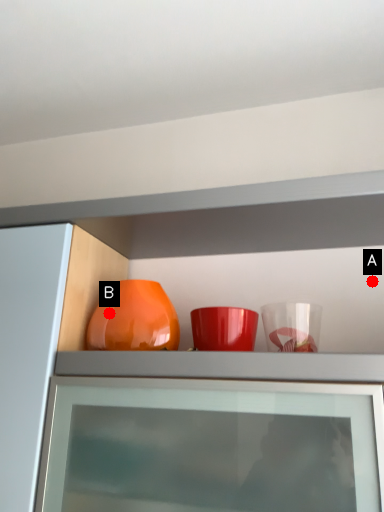
Question: Two points are circled on the image, labeled by A and B beside each circle. Which point is further to the camera?

Choices:
 (A) A is further
 (B) B is further

Answer: (A)